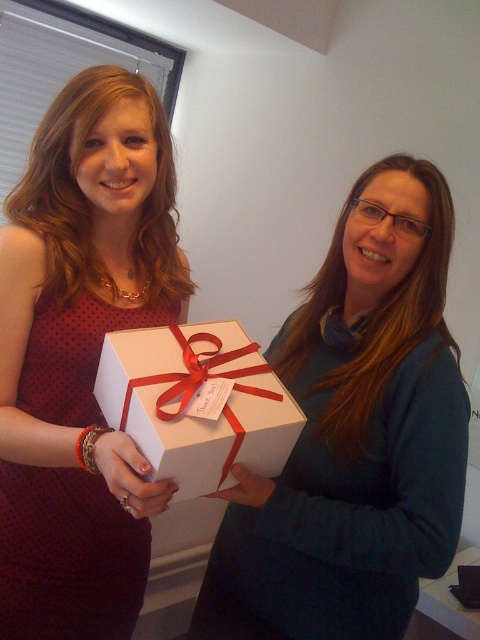
You are standing in front of two items displayed at a store. You see a matte white sweater at center and a matte black dress at center. Which item is positioned more to the right side?

The matte white sweater at center is positioned more to the right side than the matte black dress at center.

From the picture: You are organizing a gift wrapping station and need to place a matte white sweater at center and a white matte gift box at center on a shelf. According to the image, which item should be placed to the left to ensure they are arranged as shown?

The white matte gift box at center should be placed to the left of the matte white sweater at center because the matte white sweater at center is to the right of the white matte gift box at center in the image.